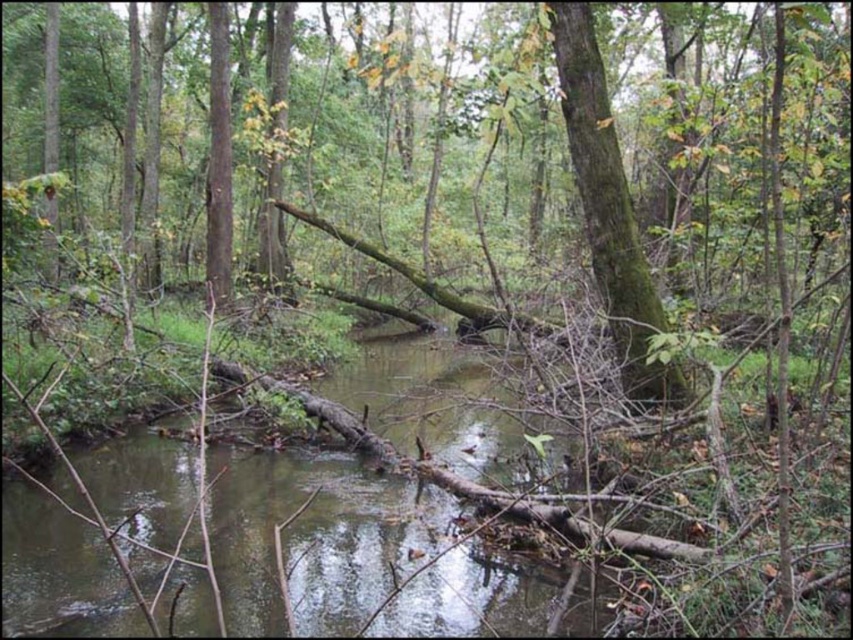
Is brown wood stream at center below green mossy tree trunk at center?

Correct, brown wood stream at center is located below green mossy tree trunk at center.

Does brown wood stream at center have a larger size compared to green mossy tree trunk at center?

Actually, brown wood stream at center might be smaller than green mossy tree trunk at center.

I want to click on brown wood stream at center, so click(316, 536).